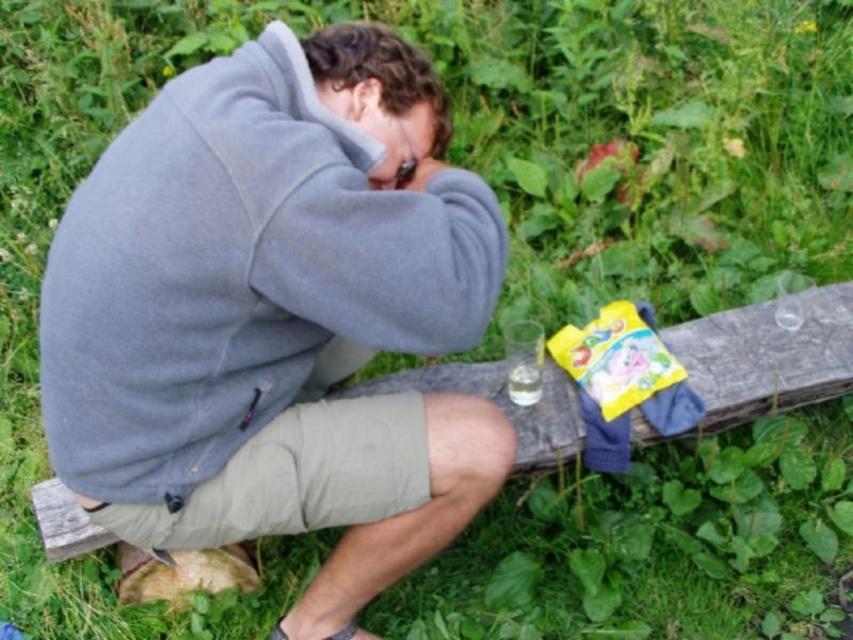
What is the point at coordinate (276,314) located on?

The point at coordinate (276,314) is located on the gray fleece jacket at center.

You are a delivery person who needs to place a package between the gray fleece jacket at center and the wooden bench at center. Is there enough space for the package, which is 24 inches long, to fit between them?

The distance between the gray fleece jacket at center and the wooden bench at center is 23.24 inches. Since the package is 24 inches long, it will not fit between them as the space is slightly smaller than the package.